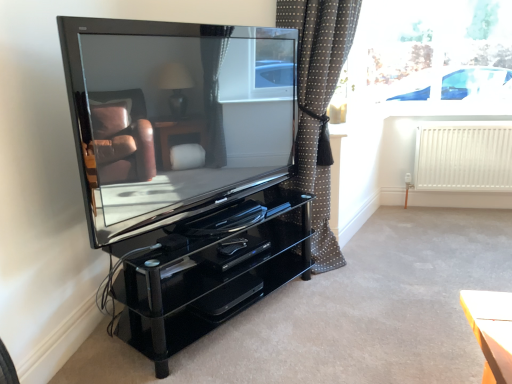
The image size is (512, 384). Find the location of `free space between polka dot fabric curtain at center and white matte radiator at right`. free space between polka dot fabric curtain at center and white matte radiator at right is located at coordinates (412, 233).